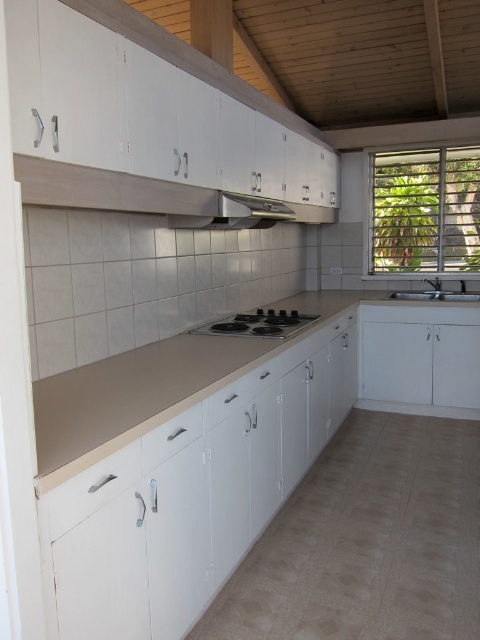
Question: Does matte black exhaust hood at upper center appear over satin nickel sink at right?

Choices:
 (A) no
 (B) yes

Answer: (B)

Question: Estimate the real-world distances between objects in this image. Which object is closer to the satin nickel sink at right?

Choices:
 (A) black glass stove at center
 (B) beige laminate counter top at center

Answer: (A)

Question: Which object appears farthest from the camera in this image?

Choices:
 (A) matte black exhaust hood at upper center
 (B) black glass stove at center

Answer: (B)

Question: Which point is closer to the camera taking this photo?

Choices:
 (A) (224, 216)
 (B) (321, 320)

Answer: (A)

Question: Can you confirm if matte black exhaust hood at upper center is positioned to the left of black glass stove at center?

Choices:
 (A) yes
 (B) no

Answer: (A)

Question: Can you confirm if black glass stove at center is wider than satin nickel sink at right?

Choices:
 (A) no
 (B) yes

Answer: (B)